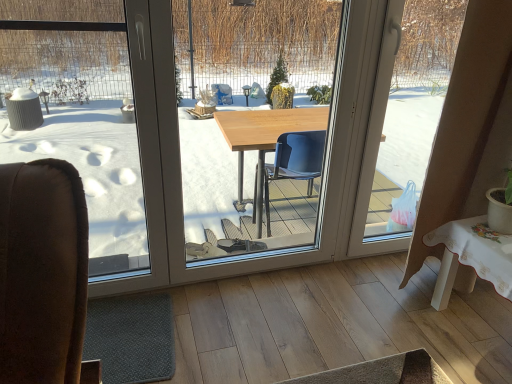
Question: Is transparent plastic bag at right, which is the first window screen in right-to-left order, spatially inside wooden table at center, arranged as the 2th window screen when viewed from the right, or outside of it?

Choices:
 (A) inside
 (B) outside

Answer: (B)

Question: In the image, is transparent plastic bag at right, the third window screen when ordered from left to right, positioned in front of or behind wooden table at center, acting as the second window screen starting from the left?

Choices:
 (A) front
 (B) behind

Answer: (B)

Question: Which is farther from the wooden table at center, arranged as the 2th window screen when viewed from the right?

Choices:
 (A) transparent plastic bag at right, the third window screen when ordered from left to right
 (B) gray rubber mat at lower left
 (C) transparent glass window at left, the 3th window screen positioned from the right

Answer: (B)

Question: Which object is positioned closest to the transparent plastic bag at right, the third window screen when ordered from left to right?

Choices:
 (A) gray rubber mat at lower left
 (B) transparent glass window at left, the 1th window screen when ordered from left to right
 (C) wooden table at center, arranged as the 2th window screen when viewed from the right

Answer: (C)